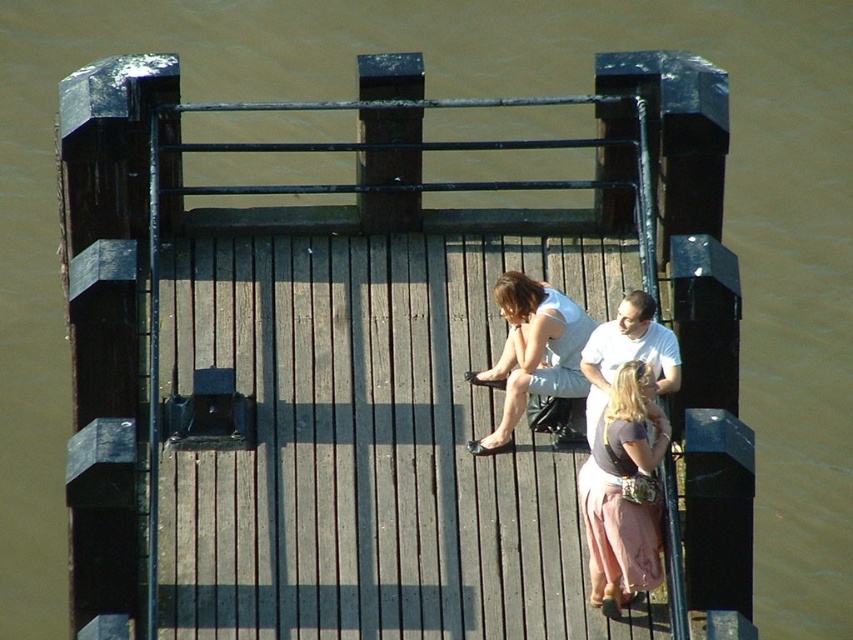
Question: Which object is closer to the camera taking this photo?

Choices:
 (A) white cotton shirt at center
 (B) matte pink skirt at center

Answer: (B)

Question: Observing the image, what is the correct spatial positioning of matte pink skirt at center in reference to matte white tank top at center?

Choices:
 (A) below
 (B) above

Answer: (A)

Question: Among these points, which one is nearest to the camera?

Choices:
 (A) pyautogui.click(x=643, y=346)
 (B) pyautogui.click(x=621, y=522)

Answer: (B)

Question: From the image, what is the correct spatial relationship of matte pink skirt at center in relation to matte white tank top at center?

Choices:
 (A) left
 (B) right

Answer: (B)

Question: Is matte pink skirt at center further to the viewer compared to white cotton shirt at center?

Choices:
 (A) no
 (B) yes

Answer: (A)

Question: Which object is closer to the camera taking this photo?

Choices:
 (A) matte pink skirt at center
 (B) white cotton shirt at center

Answer: (A)